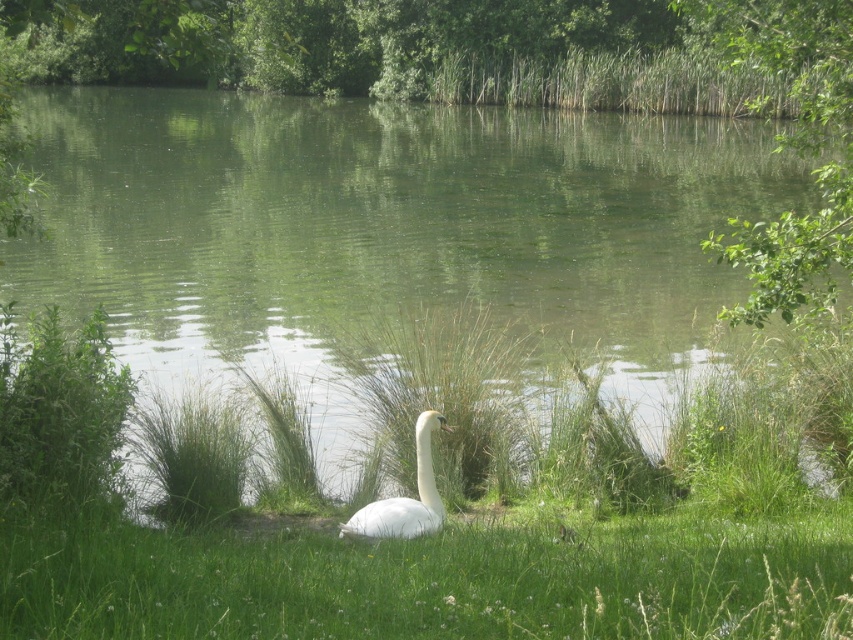
Does green grass at center have a greater height compared to white feathered swan at center?

Yes.

Is point (120, 394) behind point (370, 516)?

Yes, it is behind point (370, 516).

This screenshot has width=853, height=640. I want to click on green grass at center, so click(x=363, y=552).

Can you confirm if green water at center is shorter than white feathered swan at center?

No.

Find the location of a particular element. green water at center is located at coordinates (387, 236).

What are the coordinates of `green water at center` in the screenshot? It's located at (387, 236).

Is green water at center to the left of green grass at center from the viewer's perspective?

Indeed, green water at center is positioned on the left side of green grass at center.

At what (x,y) coordinates should I click in order to perform the action: click on green water at center. Please return your answer as a coordinate pair (x, y). Looking at the image, I should click on (387, 236).

This screenshot has width=853, height=640. I want to click on green water at center, so click(x=387, y=236).

I want to click on green water at center, so click(x=387, y=236).